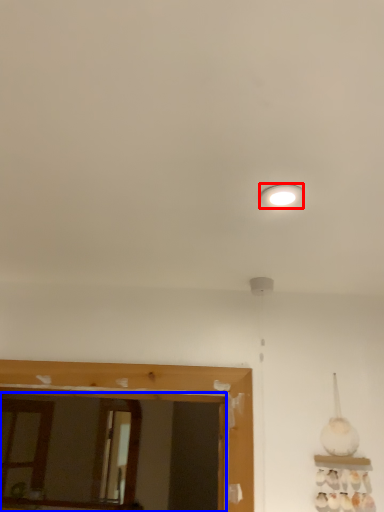
Question: Among these objects, which one is farthest to the camera, lighting (highlighted by a red box) or mirror (highlighted by a blue box)?

Choices:
 (A) lighting
 (B) mirror

Answer: (B)